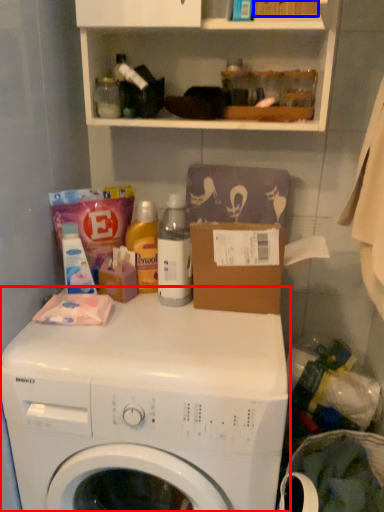
Question: Which point is closer to the camera, washing machine (highlighted by a red box) or box (highlighted by a blue box)?

Choices:
 (A) washing machine
 (B) box

Answer: (A)